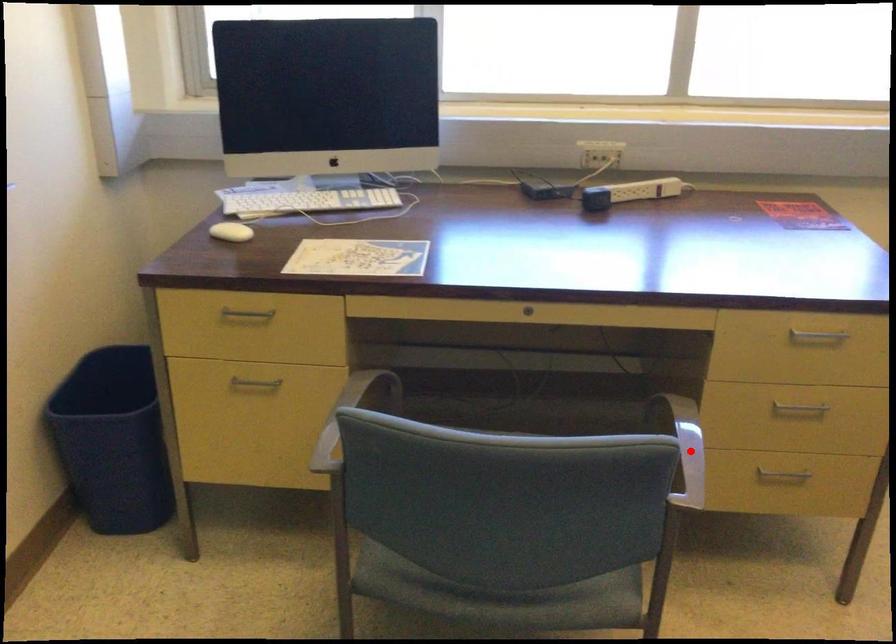
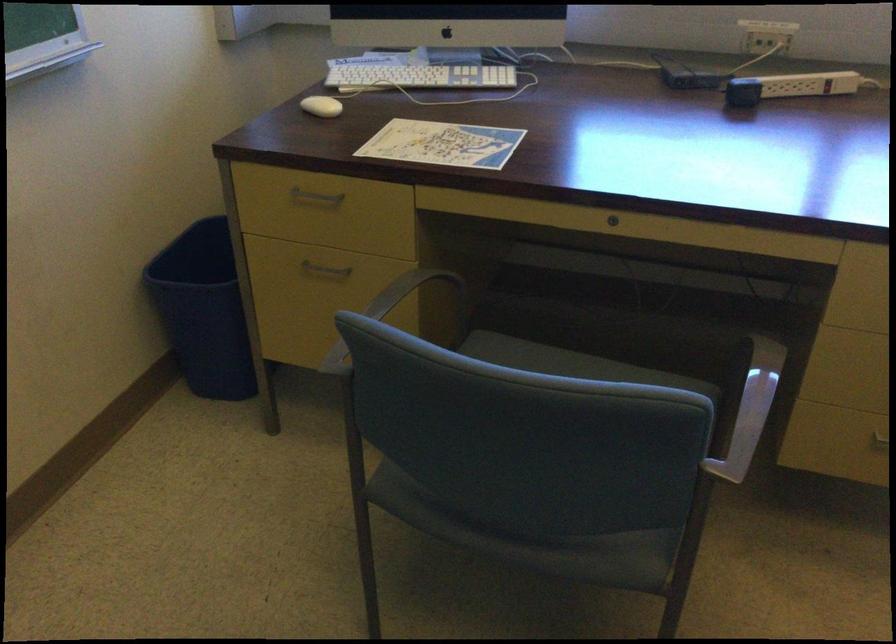
Locate, in the second image, the point that corresponds to the highlighted location in the first image.

(750, 410)